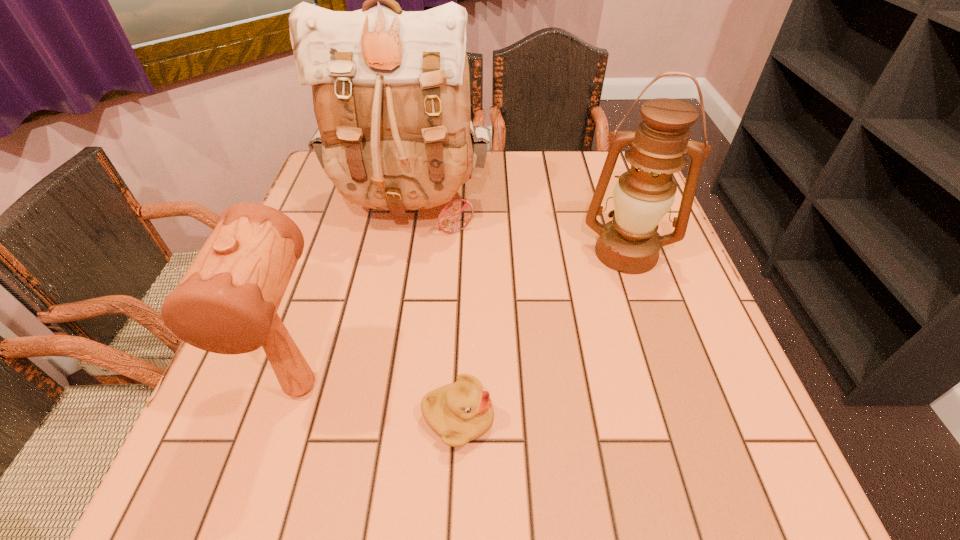
I want to click on backpack, so click(x=391, y=91).

Where is `oil lamp`? The width and height of the screenshot is (960, 540). oil lamp is located at coordinates (642, 198).

Locate an element on the screen. The image size is (960, 540). the third shortest object is located at coordinates (642, 198).

Where is `the second shortest object`? This screenshot has height=540, width=960. the second shortest object is located at coordinates (227, 302).

Locate an element on the screen. The height and width of the screenshot is (540, 960). duckling is located at coordinates (459, 412).

Locate an element on the screen. The height and width of the screenshot is (540, 960). free space located on the front-facing side of the backpack is located at coordinates (396, 282).

This screenshot has height=540, width=960. I want to click on vacant space located 0.320m on the front of the rightmost object, so click(x=682, y=415).

Locate an element on the screen. vacant region located on the strike surface of the mallet is located at coordinates [x=275, y=474].

The height and width of the screenshot is (540, 960). What are the coordinates of `free space located on the front-facing side of the shortest object` in the screenshot? It's located at (543, 418).

Identify the location of object situated at the far edge. Image resolution: width=960 pixels, height=540 pixels. (391, 91).